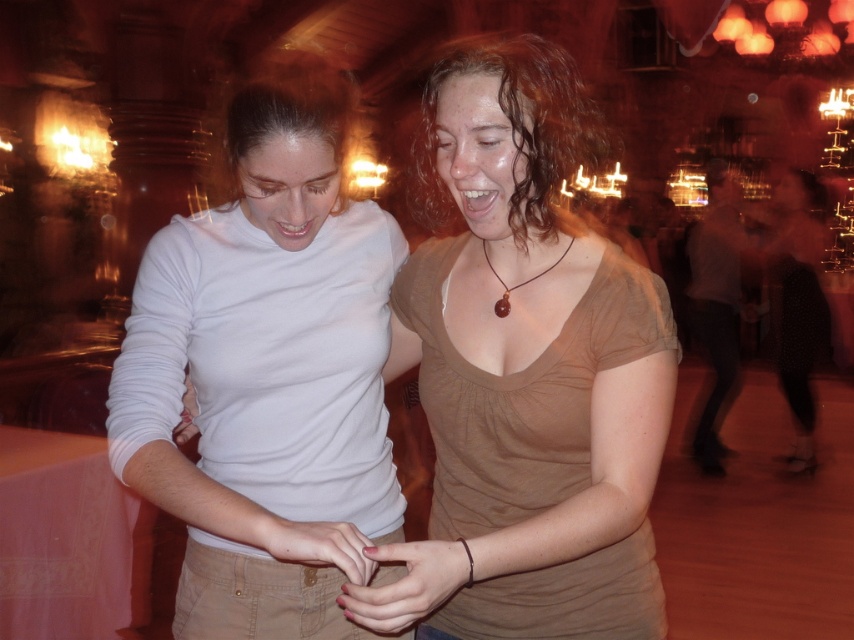
Question: Which point is closer to the camera?

Choices:
 (A) (309, 74)
 (B) (499, 314)
 (C) (323, 557)
 (D) (500, 193)

Answer: (C)

Question: Can you confirm if matte brown shirt at center is positioned above matte white hand at lower left?

Choices:
 (A) no
 (B) yes

Answer: (B)

Question: Can you confirm if brown matte shirt at center is positioned above brown wooden pendant at center?

Choices:
 (A) no
 (B) yes

Answer: (A)

Question: Is light gray shirt at right to the left of smooth white shirt at upper left from the viewer's perspective?

Choices:
 (A) yes
 (B) no

Answer: (B)

Question: Which point is closer to the camera?

Choices:
 (A) (575, 122)
 (B) (186, 412)
 (C) (728, 403)
 (D) (389, 518)

Answer: (A)

Question: Among these objects, which one is nearest to the camera?

Choices:
 (A) light gray shirt at right
 (B) brown wooden pendant at center

Answer: (B)